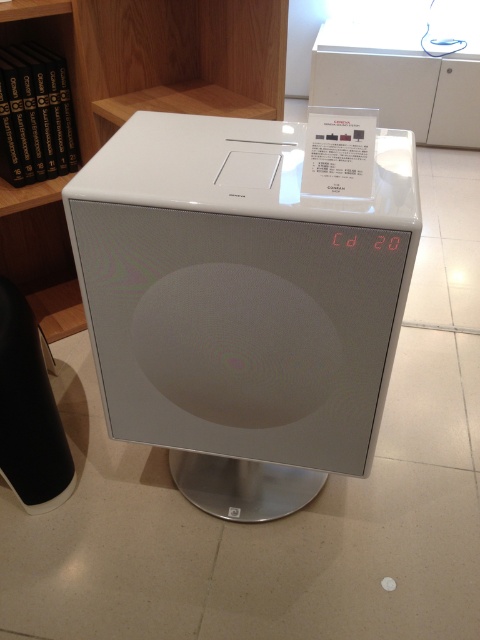
Question: Can you confirm if white glossy air purifier at center is smaller than white matte bookshelf at upper center?

Choices:
 (A) no
 (B) yes

Answer: (A)

Question: Which point is closer to the camera taking this photo?

Choices:
 (A) (111, 29)
 (B) (355, 433)

Answer: (B)

Question: Can you confirm if white glossy air purifier at center is positioned above white matte bookshelf at upper center?

Choices:
 (A) no
 (B) yes

Answer: (A)

Question: Can you confirm if white glossy air purifier at center is positioned to the left of white matte bookshelf at upper center?

Choices:
 (A) no
 (B) yes

Answer: (A)